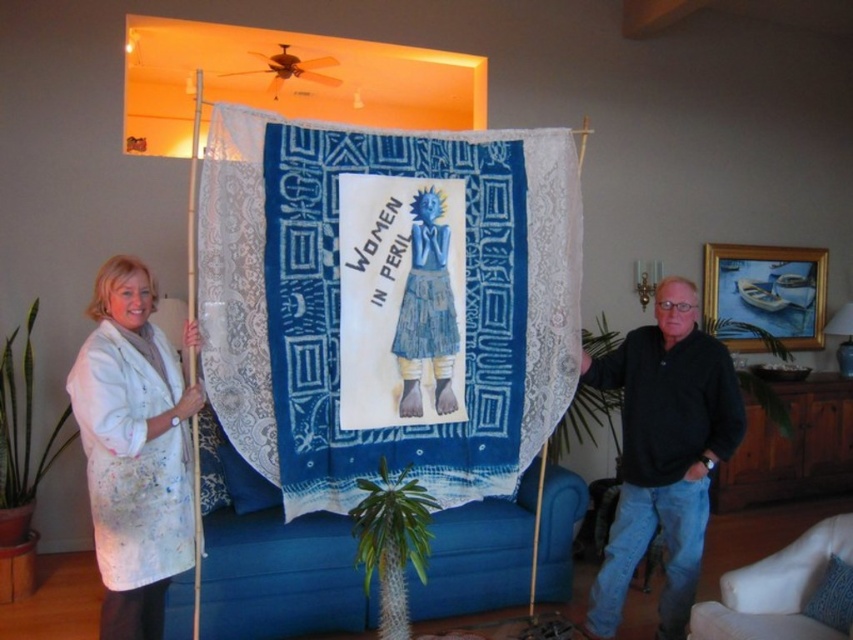
Does blue batik fabric at center come in front of white paint splattered coat at left?

No.

Does point (457, 492) come behind point (94, 356)?

Yes, it is behind point (94, 356).

Find the location of a particular element. blue batik fabric at center is located at coordinates (387, 301).

Can you confirm if white paint splattered coat at left is positioned to the left of black cotton shirt at right?

Indeed, white paint splattered coat at left is positioned on the left side of black cotton shirt at right.

Locate an element on the screen. white paint splattered coat at left is located at coordinates (132, 449).

This screenshot has width=853, height=640. Identify the location of black cotton shirt at right. (x=664, y=452).

Who is taller, black cotton shirt at right or white fabric couch at lower right?

With more height is black cotton shirt at right.

Identify the location of black cotton shirt at right. The width and height of the screenshot is (853, 640). (664, 452).